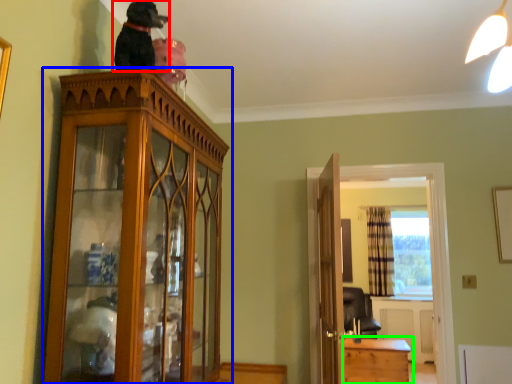
Question: Which is nearer to the dog (highlighted by a red box)? cabinetry (highlighted by a blue box) or table (highlighted by a green box).

Choices:
 (A) cabinetry
 (B) table

Answer: (A)